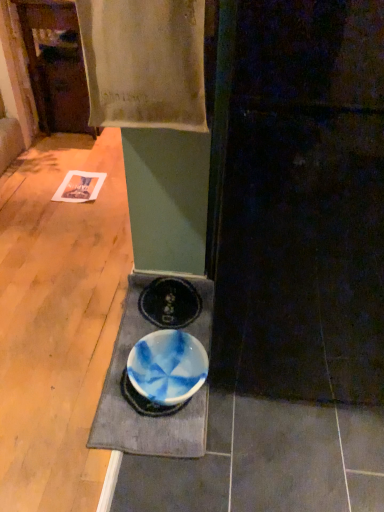
Image resolution: width=384 pixels, height=512 pixels. What are the coordinates of `white cotton towel at upper center` in the screenshot? It's located at (144, 63).

Identify the location of white cotton towel at upper center. (144, 63).

From the image's perspective, which is below, white cotton towel at upper center or smooth dark wood door at center?

From the image's view, smooth dark wood door at center is below.

Locate an element on the screen. Image resolution: width=384 pixels, height=512 pixels. blanket located on the left of smooth dark wood door at center is located at coordinates (144, 63).

From their relative heights in the image, would you say white cotton towel at upper center is taller or shorter than smooth dark wood door at center?

white cotton towel at upper center is shorter than smooth dark wood door at center.

In the scene shown: Could you tell me if white cotton towel at upper center is facing smooth dark wood door at center?

No, white cotton towel at upper center is not aimed at smooth dark wood door at center.

From a real-world perspective, relative to smooth dark wood door at center, is blue glazed bowl at lower center vertically above or below?

Clearly, from a real-world perspective, blue glazed bowl at lower center is below smooth dark wood door at center.

At what (x,y) coordinates should I click in order to perform the action: click on door positioned vertically above the blue glazed bowl at lower center (from a real-world perspective). Please return your answer as a coordinate pair (x, y). The height and width of the screenshot is (512, 384). Looking at the image, I should click on (304, 205).

Considering the sizes of blue glazed bowl at lower center and smooth dark wood door at center in the image, is blue glazed bowl at lower center bigger or smaller than smooth dark wood door at center?

Clearly, blue glazed bowl at lower center is smaller in size than smooth dark wood door at center.

Between smooth dark wood door at center and blue glossy bowl at center, which one has larger size?

smooth dark wood door at center is bigger.

Is smooth dark wood door at center facing away from blue glossy bowl at center?

smooth dark wood door at center is not turned away from blue glossy bowl at center.

What are the coordinates of `table on the left of smooth dark wood door at center` in the screenshot? It's located at (133, 410).

How many degrees apart are the facing directions of smooth dark wood door at center and blue glossy bowl at center?

They differ by 87 degrees in their facing directions.

Can you confirm if white cotton towel at upper center is positioned to the left of blue glazed bowl at lower center?

Indeed, white cotton towel at upper center is positioned on the left side of blue glazed bowl at lower center.

Is white cotton towel at upper center closer to the viewer compared to blue glazed bowl at lower center?

Yes, white cotton towel at upper center is closer to the camera.

Can you confirm if white cotton towel at upper center is smaller than blue glazed bowl at lower center?

Incorrect, white cotton towel at upper center is not smaller in size than blue glazed bowl at lower center.

From the image's perspective, between white cotton towel at upper center and blue glazed bowl at lower center, which one is located above?

white cotton towel at upper center is shown above in the image.

Considering their positions, is white cotton towel at upper center located in front of or behind blue glossy bowl at center?

Visually, white cotton towel at upper center is located in front of blue glossy bowl at center.

Would you say white cotton towel at upper center is inside or outside blue glossy bowl at center?

white cotton towel at upper center cannot be found inside blue glossy bowl at center.

Is white cotton towel at upper center looking in the opposite direction of blue glossy bowl at center?

No, white cotton towel at upper center is not facing away from blue glossy bowl at center.

From the image's perspective, between white cotton towel at upper center and blue glossy bowl at center, which one is located above?

white cotton towel at upper center is shown above in the image.

From the image's perspective, which one is positioned higher, blue glazed bowl at lower center or blue glossy bowl at center?

From the image's view, blue glossy bowl at center is above.

The height and width of the screenshot is (512, 384). I want to click on bowl that appears on the right of blue glossy bowl at center, so click(167, 367).

Considering the points (158, 333) and (124, 324), which point is behind, point (158, 333) or point (124, 324)?

The point (124, 324) is more distant.

Does blue glazed bowl at lower center come in front of blue glossy bowl at center?

No, it is not.

Between blue glossy bowl at center and blue glazed bowl at lower center, which one has more height?

blue glazed bowl at lower center is taller.

How different are the orientations of blue glossy bowl at center and blue glazed bowl at lower center in degrees?

0.000712 degrees.

Is blue glossy bowl at center far away from blue glazed bowl at lower center?

They are positioned close to each other.

Locate an element on the screen. blanket that is behind the smooth dark wood door at center is located at coordinates (144, 63).

At what (x,y) coordinates should I click in order to perform the action: click on door on the right of blue glazed bowl at lower center. Please return your answer as a coordinate pair (x, y). Looking at the image, I should click on (304, 205).

Estimate the real-world distances between objects in this image. Which object is closer to blue glazed bowl at lower center, blue glossy bowl at center or white cotton towel at upper center?

blue glossy bowl at center is closer to blue glazed bowl at lower center.

Looking at the image, which one is located closer to white cotton towel at upper center, blue glossy bowl at center or blue glazed bowl at lower center?

The object closer to white cotton towel at upper center is blue glossy bowl at center.

Based on the photo, estimate the real-world distances between objects in this image. Which object is closer to blue glossy bowl at center, white cotton towel at upper center or smooth dark wood door at center?

smooth dark wood door at center is closer to blue glossy bowl at center.

Which object lies nearer to the anchor point smooth dark wood door at center, blue glossy bowl at center or blue glazed bowl at lower center?

blue glazed bowl at lower center lies closer to smooth dark wood door at center than the other object.

Considering their positions, is smooth dark wood door at center positioned closer to white cotton towel at upper center than blue glazed bowl at lower center?

smooth dark wood door at center lies closer to white cotton towel at upper center than the other object.

Considering their positions, is blue glazed bowl at lower center positioned closer to blue glossy bowl at center than smooth dark wood door at center?

Based on the image, blue glazed bowl at lower center appears to be nearer to blue glossy bowl at center.

Estimate the real-world distances between objects in this image. Which object is further from blue glossy bowl at center, smooth dark wood door at center or white cotton towel at upper center?

The object further to blue glossy bowl at center is white cotton towel at upper center.

Looking at the image, which one is located further to smooth dark wood door at center, white cotton towel at upper center or blue glazed bowl at lower center?

Among the two, white cotton towel at upper center is located further to smooth dark wood door at center.

Identify the location of door between white cotton towel at upper center and blue glazed bowl at lower center from top to bottom. Image resolution: width=384 pixels, height=512 pixels. (304, 205).

The height and width of the screenshot is (512, 384). I want to click on table that lies between white cotton towel at upper center and blue glazed bowl at lower center from top to bottom, so [133, 410].

Identify the location of table between smooth dark wood door at center and blue glazed bowl at lower center along the z-axis. (133, 410).

Locate an element on the screen. This screenshot has width=384, height=512. door between white cotton towel at upper center and blue glossy bowl at center in the vertical direction is located at coordinates (304, 205).